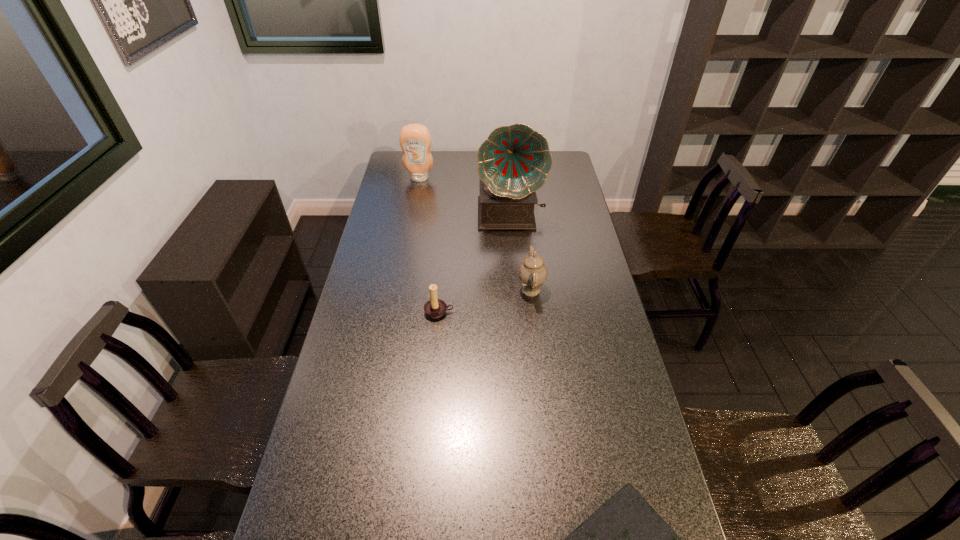
The height and width of the screenshot is (540, 960). What are the coordinates of `free space located 0.170m on the spout of the third tallest object` in the screenshot? It's located at (469, 289).

Find the location of `free point located 0.310m on the spout of the third tallest object`. free point located 0.310m on the spout of the third tallest object is located at coordinates (432, 289).

At what (x,y) coordinates should I click in order to perform the action: click on vacant space located 0.270m on the wick of the second object from left to right. Please return your answer as a coordinate pair (x, y). Looking at the image, I should click on (432, 389).

This screenshot has height=540, width=960. I want to click on object that is at the far edge, so click(x=415, y=140).

Identify the location of object that is at the left edge. The image size is (960, 540). (415, 140).

The height and width of the screenshot is (540, 960). I want to click on object positioned at the far left corner, so click(x=415, y=140).

Locate an element on the screen. free location at the left edge of the desktop is located at coordinates pos(388,273).

Find the location of a particular element. Image resolution: width=960 pixels, height=540 pixels. free region at the right edge is located at coordinates (557, 268).

The image size is (960, 540). Identify the location of free space between the third tallest object and the tallest object. (520, 252).

The width and height of the screenshot is (960, 540). Find the location of `vacant area between the second object from left to right and the second farthest object`. vacant area between the second object from left to right and the second farthest object is located at coordinates (474, 263).